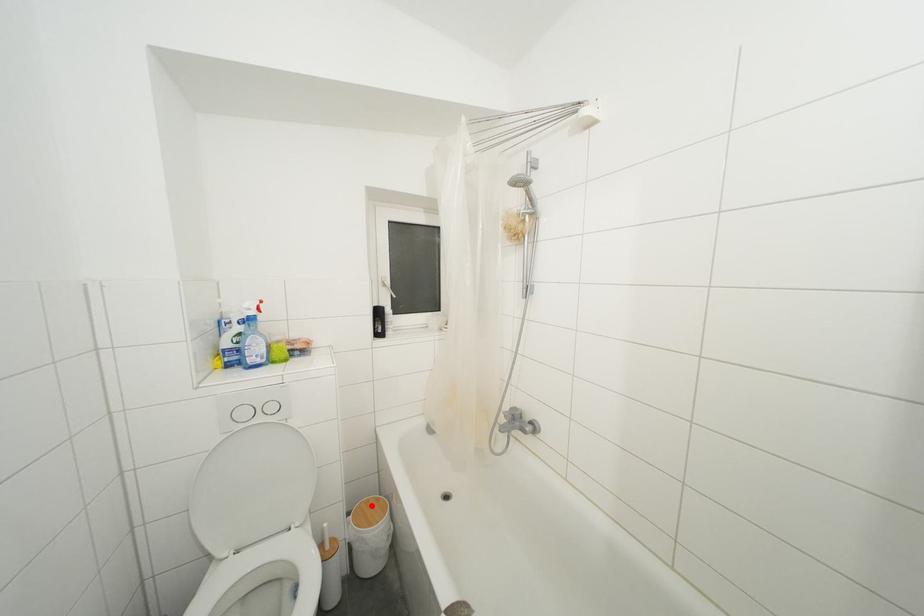
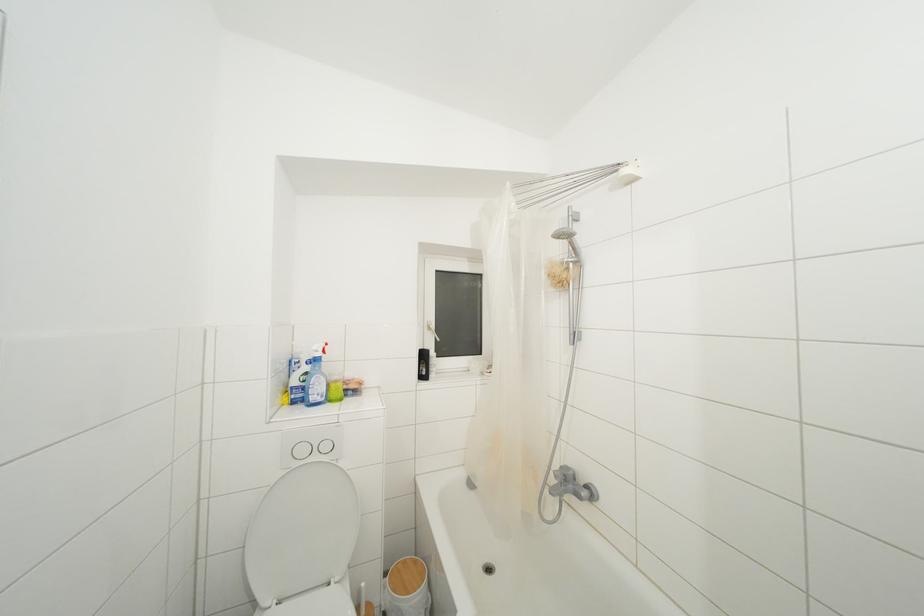
Question: A red point is marked in image1. In image2, is the corresponding 3D point closer to the camera or farther? Reply with the corresponding letter.

Choices:
 (A) The corresponding 3D point is closer.
 (B) The corresponding 3D point is farther.

Answer: (B)